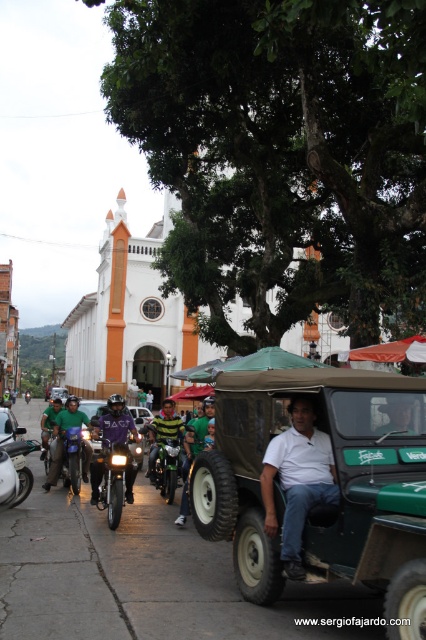
You are standing at the center of the street and want to reach both the shiny chrome motorcycle at center and the green matte motorcycle at left. Which motorcycle will require you to walk a shorter distance?

The green matte motorcycle at left is closer to you since it is only 77.40 meters away from the shiny chrome motorcycle at center, but since you are at the center, the distance to the green one would be half of that, so approximately 38.70 meters. Therefore, you need to walk a shorter distance to reach the green matte motorcycle at left.

Looking at this image, what is the position of the shiny chrome motorcycle at center in the image?

The shiny chrome motorcycle at center is located at point (112, 476).

You are a photographer trying to capture both the shiny chrome motorcycle at center and the green matte motorcycle at left in a single frame. Given their sizes, which motorcycle would appear closer to the camera if you position them side by side?

The shiny chrome motorcycle at center is smaller in size compared to the green matte motorcycle at left. If positioned side by side, the smaller shiny chrome motorcycle at center would appear closer to the camera because smaller objects can be placed nearer to achieve the same framing as larger ones.